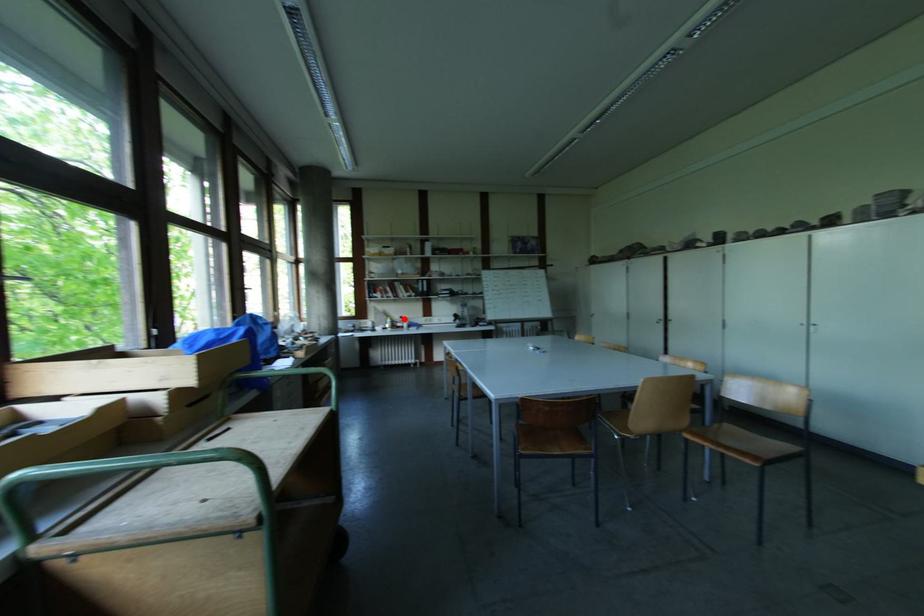
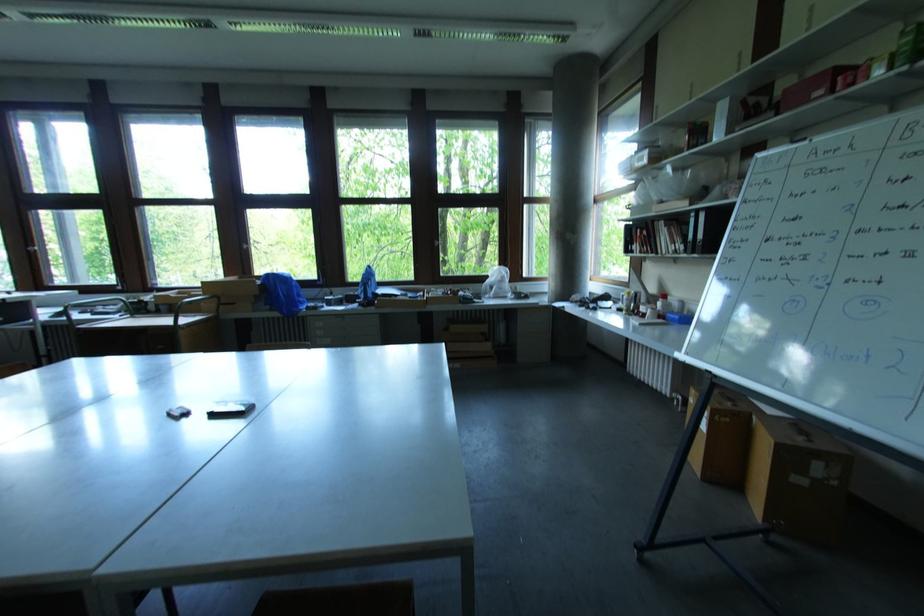
The point at the highlighted location is marked in the first image. Where is the corresponding point in the second image?

(667, 298)